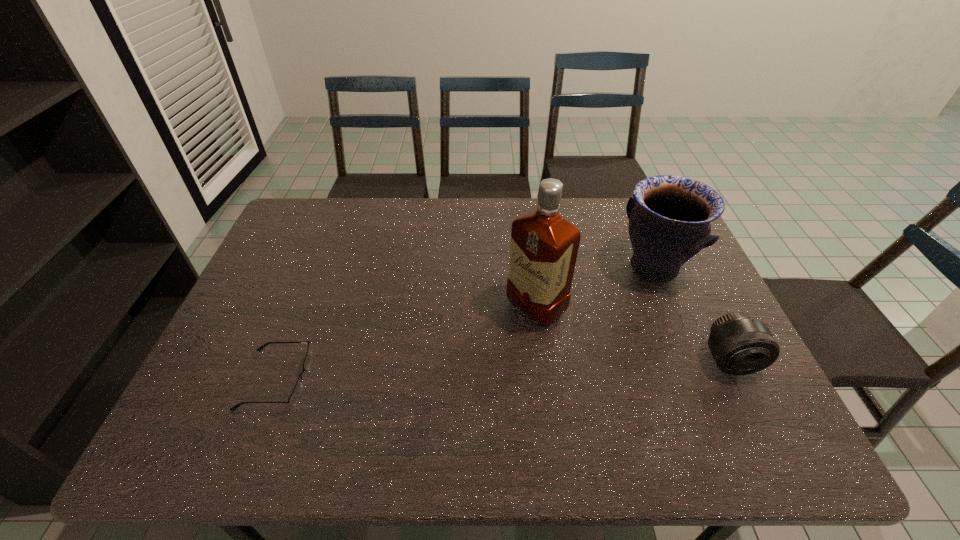
Identify the location of vacant area that lies between the third shortest object and the third object from right to left. Image resolution: width=960 pixels, height=540 pixels. (594, 288).

This screenshot has width=960, height=540. What are the coordinates of `free area in between the telephoto lens and the liquor` in the screenshot? It's located at (633, 334).

This screenshot has width=960, height=540. What are the coordinates of `vacant region between the pottery and the shortest object` in the screenshot? It's located at (465, 324).

Find the location of a particular element. The image size is (960, 540). free space between the telephoto lens and the shortest object is located at coordinates (503, 370).

Where is `free point between the tallest object and the shortest object`? This screenshot has width=960, height=540. free point between the tallest object and the shortest object is located at coordinates (406, 343).

This screenshot has height=540, width=960. In order to click on the third closest object to the shortest object in this screenshot , I will do `click(740, 345)`.

Locate an element on the screen. object that is the nearest to the third object from right to left is located at coordinates (669, 216).